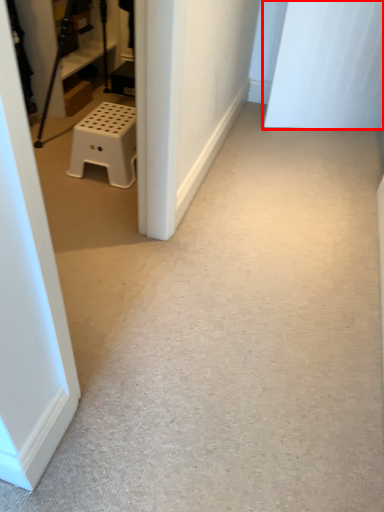
Question: Observing the image, what is the correct spatial positioning of door (annotated by the red box) in reference to furniture?

Choices:
 (A) left
 (B) right

Answer: (B)